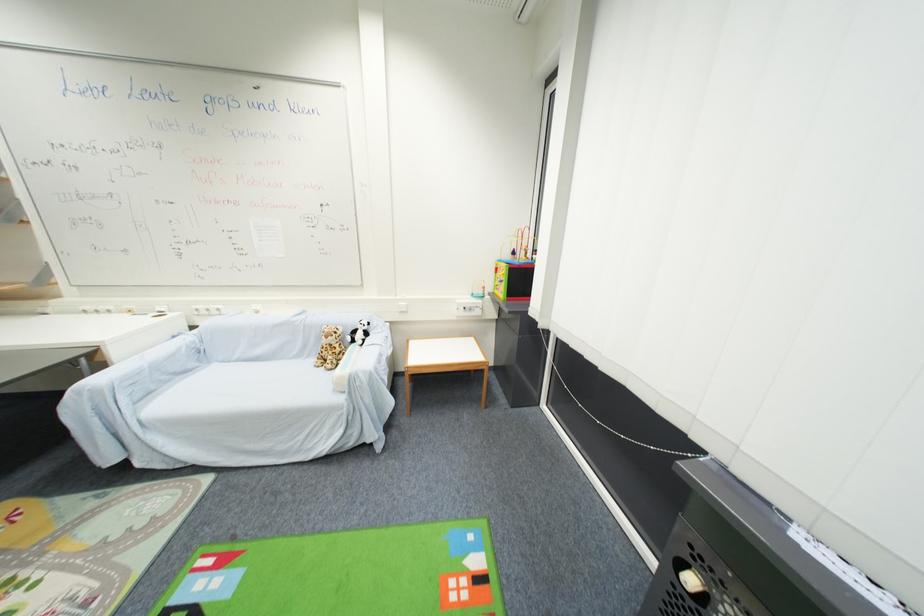
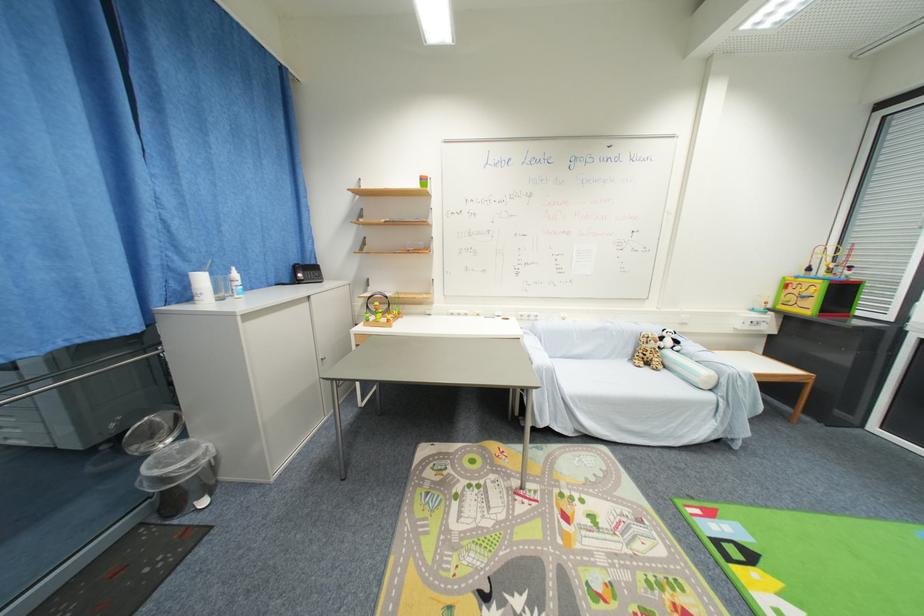
Question: Which direction would the cameraman need to move to produce the second image? Reply with the corresponding letter.

Choices:
 (A) Left
 (B) Right
 (C) Forward
 (D) Backward

Answer: (A)